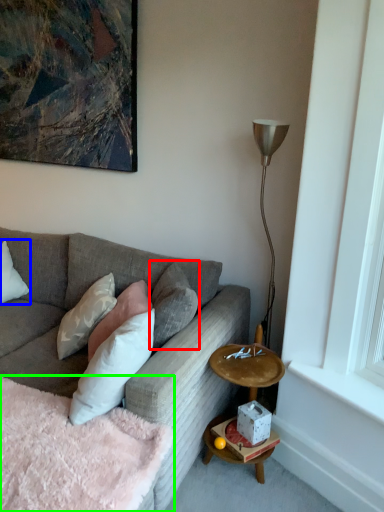
Question: Which object is positioned farthest from pillow (highlighted by a red box)? Select from pillow (highlighted by a blue box) and bedding (highlighted by a green box).

Choices:
 (A) pillow
 (B) bedding

Answer: (A)